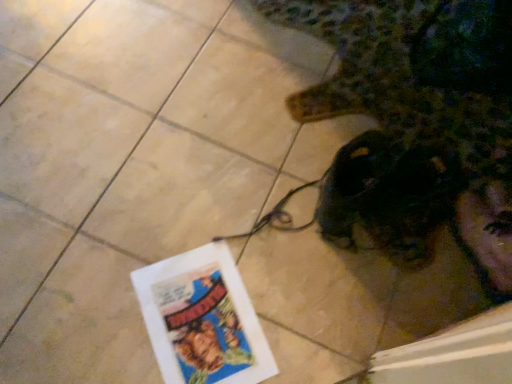
Find the location of a particular element. Image resolution: width=512 pixels, height=384 pixels. free location to the left of shiny black headphones at lower right is located at coordinates (265, 162).